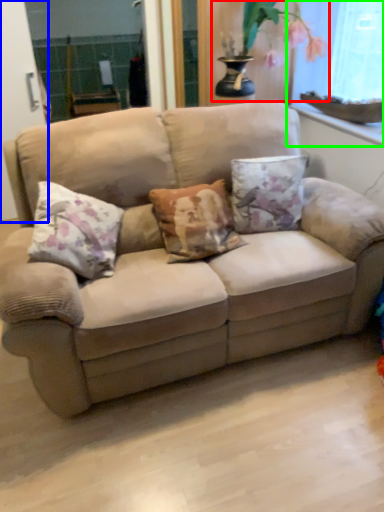
Question: Considering the real-world distances, which object is closest to floral arrangement (highlighted by a red box)? screen door (highlighted by a blue box) or window screen (highlighted by a green box).

Choices:
 (A) screen door
 (B) window screen

Answer: (B)